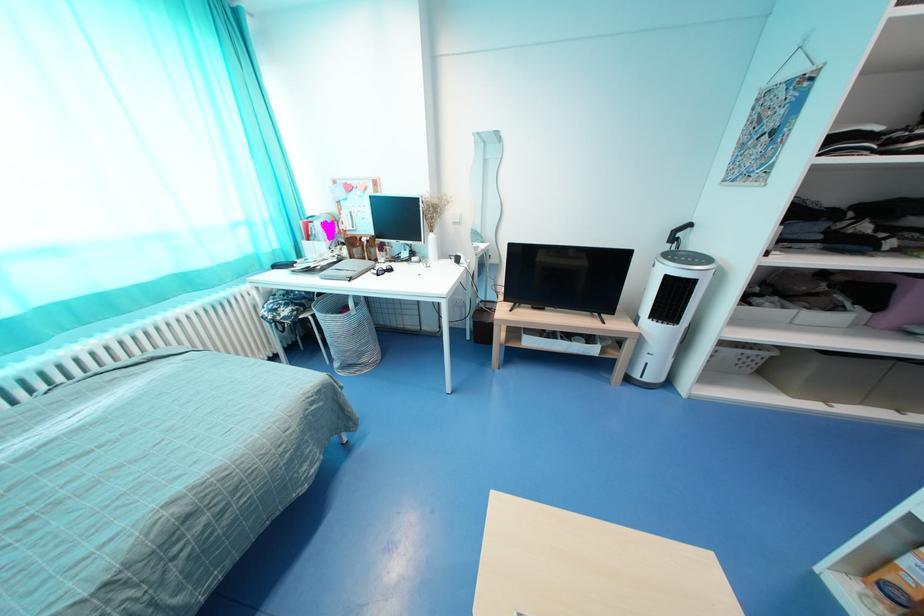
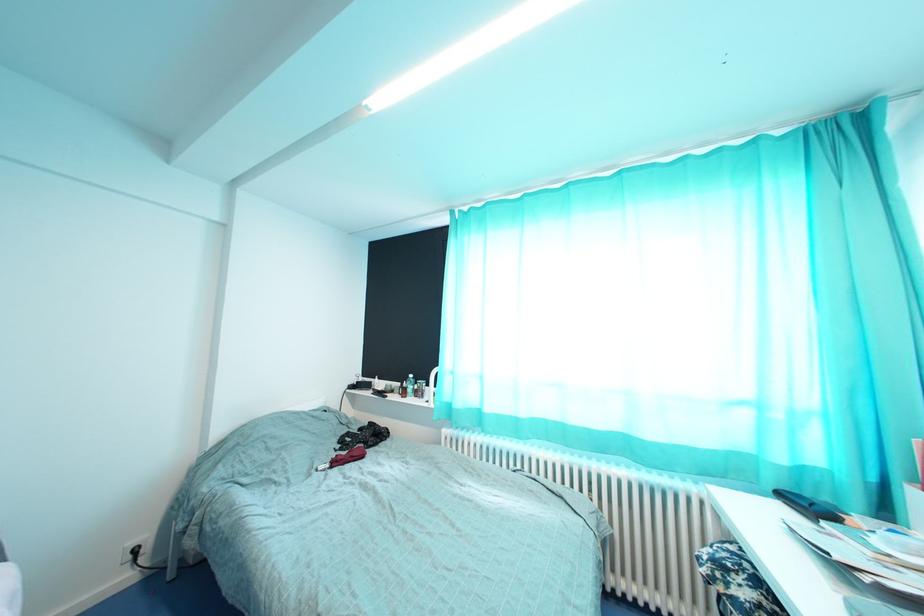
Question: The first image is from the beginning of the video and the second image is from the end. How did the camera likely rotate when shooting the video?

Choices:
 (A) Left
 (B) Right
 (C) Up
 (D) Down

Answer: (A)